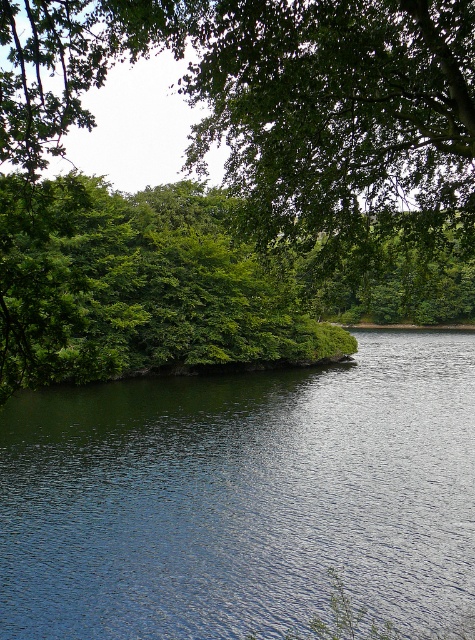
Question: Can you confirm if green leafy tree at upper center is positioned below dark blue water at center?

Choices:
 (A) no
 (B) yes

Answer: (A)

Question: Is green leafy tree at upper center wider than dark blue water at center?

Choices:
 (A) no
 (B) yes

Answer: (B)

Question: Among these points, which one is nearest to the camera?

Choices:
 (A) (46, 72)
 (B) (120, 524)

Answer: (B)

Question: Among these objects, which one is farthest from the camera?

Choices:
 (A) green leafy tree at upper center
 (B) dark blue water at center

Answer: (B)

Question: Is green leafy tree at upper center thinner than dark blue water at center?

Choices:
 (A) yes
 (B) no

Answer: (B)

Question: Which of the following is the farthest from the observer?

Choices:
 (A) (240, 196)
 (B) (355, 440)

Answer: (A)